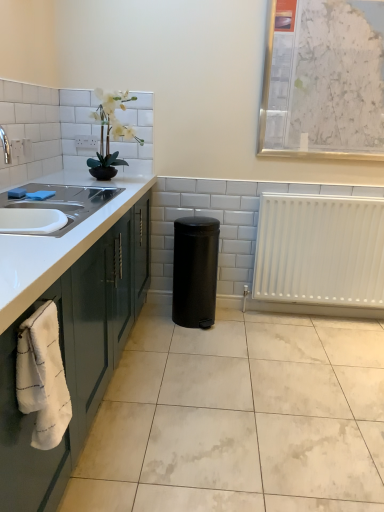
Question: Is white glossy ceramic tile at lower center to the left or to the right of white plastic radiator at lower right in the image?

Choices:
 (A) right
 (B) left

Answer: (B)

Question: From a real-world perspective, is white glossy ceramic tile at lower center physically located above or below white plastic radiator at lower right?

Choices:
 (A) above
 (B) below

Answer: (B)

Question: Which is farther from the white glossy ceramic tile at lower center?

Choices:
 (A) black matte trash can at center
 (B) white plastic radiator at lower right
 (C) white glossy countertop at left
 (D) white marble bulletin board at upper right

Answer: (D)

Question: Which object is the farthest from the black matte trash can at center?

Choices:
 (A) white plastic radiator at lower right
 (B) white glossy countertop at left
 (C) white marble bulletin board at upper right
 (D) white glossy ceramic tile at lower center

Answer: (C)